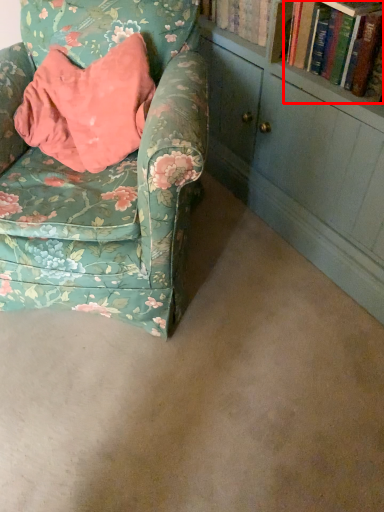
Question: From the image's perspective, considering the relative positions of book (annotated by the red box) and chair in the image provided, where is book (annotated by the red box) located with respect to the staircase?

Choices:
 (A) below
 (B) above

Answer: (B)